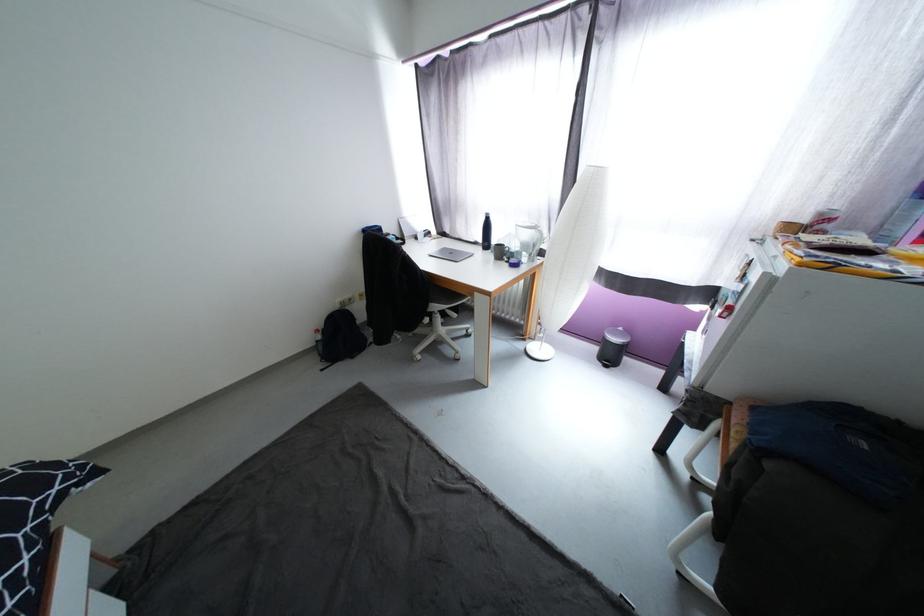
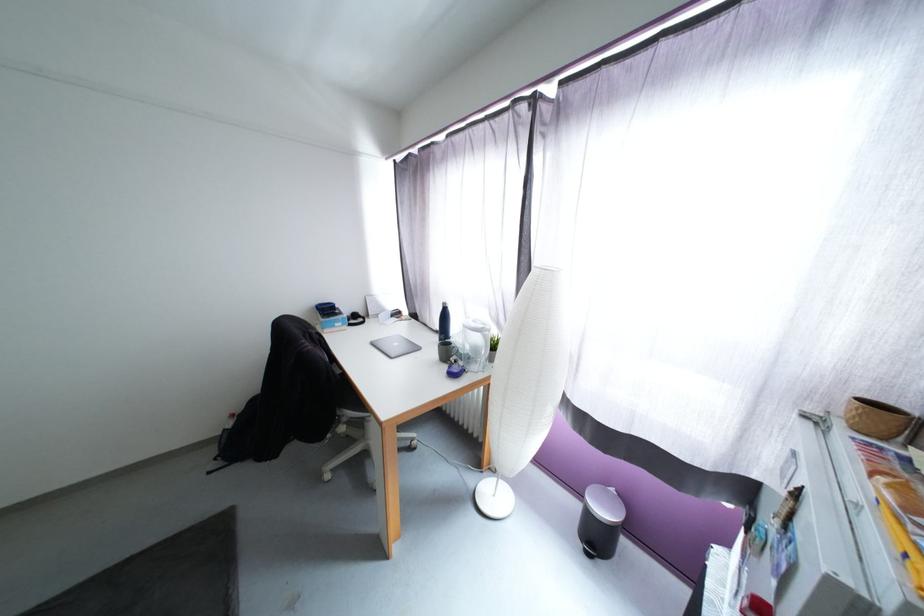
Question: The images are taken continuously from a first-person perspective. In which direction is your viewpoint rotating?

Choices:
 (A) Left
 (B) Right
 (C) Up
 (D) Down

Answer: (C)